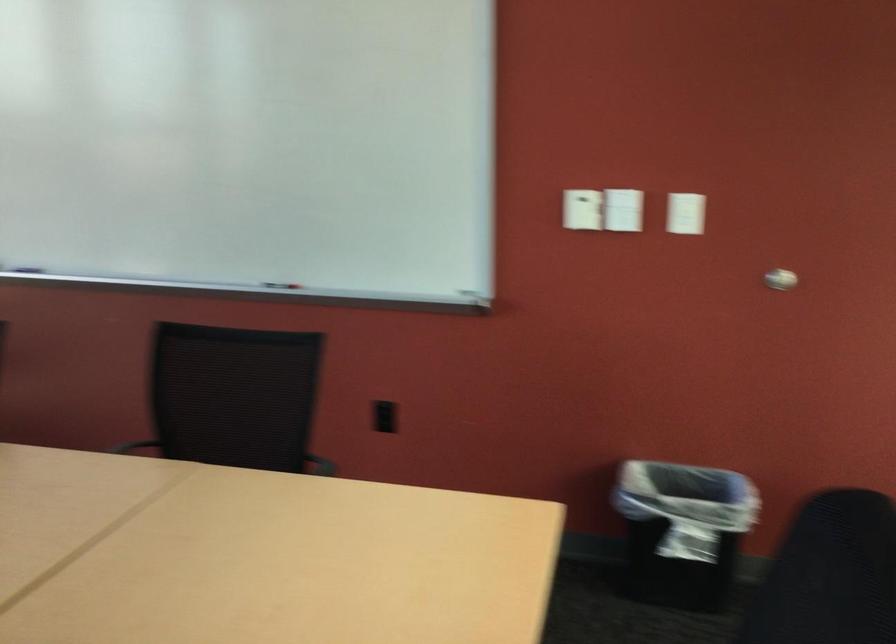
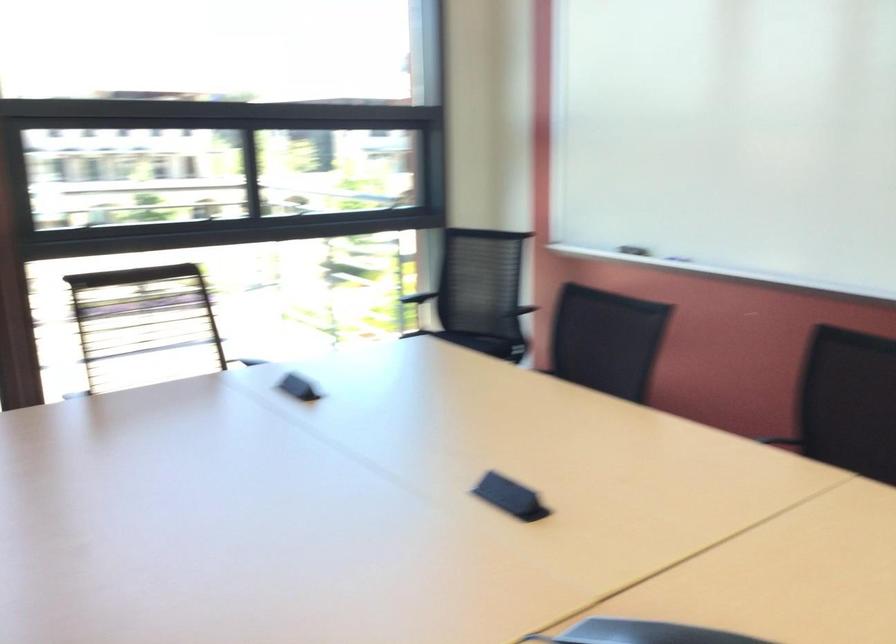
Question: The camera is either moving clockwise (left) or counter-clockwise (right) around the object. The first image is from the beginning of the video and the second image is from the end. Is the camera moving left or right when shooting the video?

Choices:
 (A) Left
 (B) Right

Answer: (B)